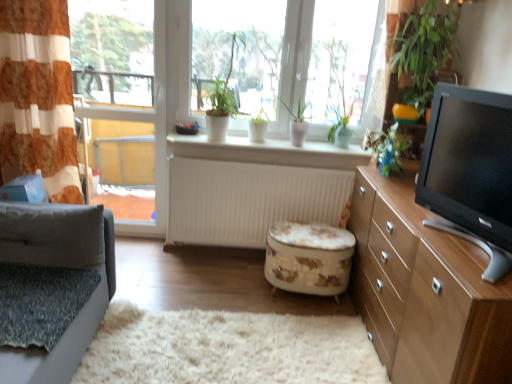
What are the coordinates of `free space in front of floral-patterned fabric ottoman at center` in the screenshot? It's located at (292, 319).